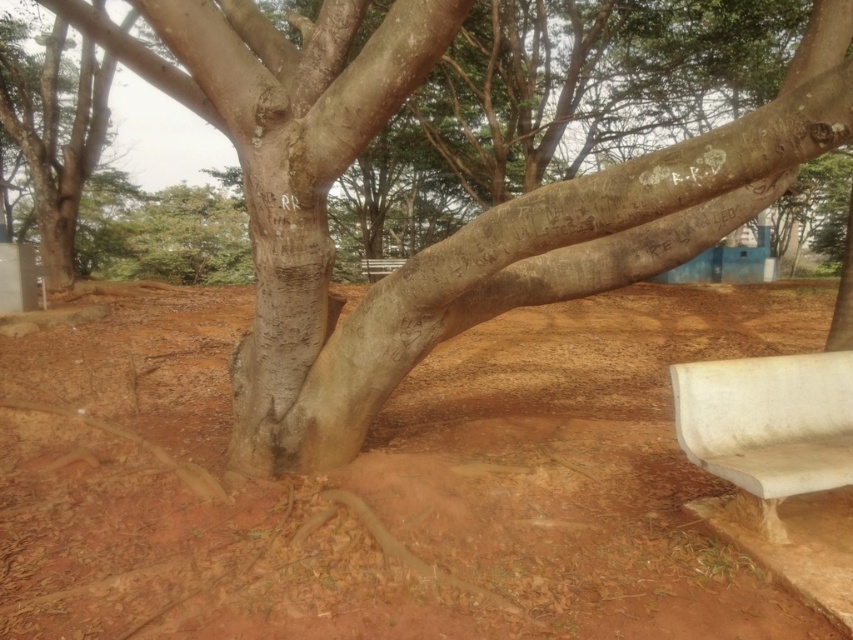
Is white marble bench at lower right positioned behind white plastic bench at center?

No, it is not.

Can you confirm if white marble bench at lower right is shorter than white plastic bench at center?

Yes.

Identify the location of white marble bench at lower right. (767, 428).

Is smooth bark tree at center bigger than white plastic bench at center?

Actually, smooth bark tree at center might be smaller than white plastic bench at center.

Which is above, smooth bark tree at center or white plastic bench at center?

white plastic bench at center

What do you see at coordinates (454, 232) in the screenshot?
I see `smooth bark tree at center` at bounding box center [454, 232].

The width and height of the screenshot is (853, 640). Find the location of `smooth bark tree at center`. smooth bark tree at center is located at coordinates (454, 232).

Does brown soil at center appear on the left side of white marble bench at lower right?

Yes, brown soil at center is to the left of white marble bench at lower right.

Does brown soil at center have a greater width compared to white marble bench at lower right?

Yes.

Is point (190, 422) less distant than point (827, 417)?

No.

Where is `brown soil at center`? brown soil at center is located at coordinates (386, 481).